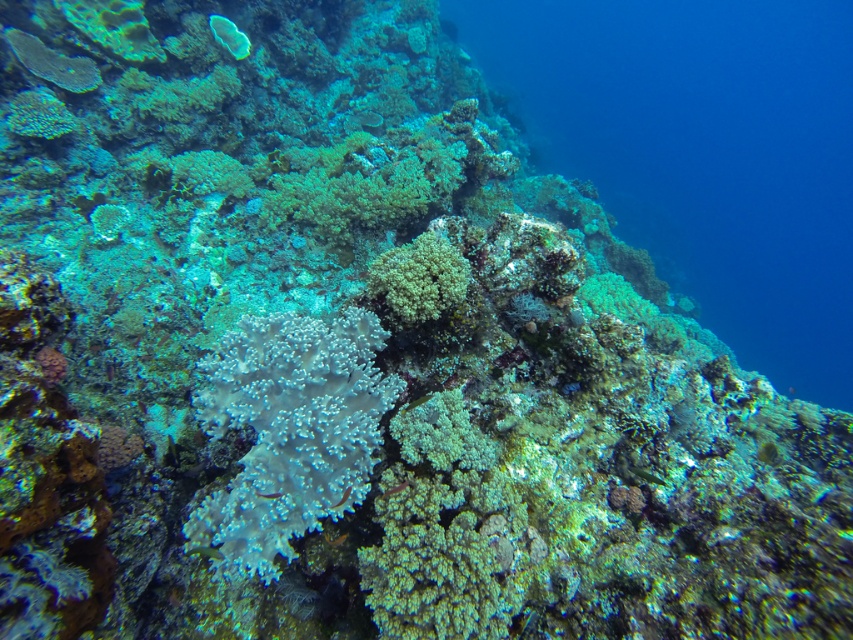
Which is above, translucent white coral at upper left or shiny green fish at center?

translucent white coral at upper left is higher up.

Does translucent white coral at upper left have a smaller size compared to shiny green fish at center?

No.

Locate an element on the screen. This screenshot has height=640, width=853. translucent white coral at upper left is located at coordinates (229, 35).

You are a GUI agent. You are given a task and a screenshot of the screen. Output one action in this format:
    pyautogui.click(x=<x>, y=<y>)
    Task: Click on the translucent white coral at upper left
    The image size is (853, 640).
    Given the screenshot: What is the action you would take?
    pyautogui.click(x=229, y=35)

Between green soft coral at center and translucent white coral at center, which one is positioned lower?

translucent white coral at center is below.

Does point (369, 273) come farther from viewer compared to point (346, 499)?

Yes, point (369, 273) is behind point (346, 499).

You are a GUI agent. You are given a task and a screenshot of the screen. Output one action in this format:
    pyautogui.click(x=<x>, y=<y>)
    Task: Click on the green soft coral at center
    The image size is (853, 640).
    Given the screenshot: What is the action you would take?
    pyautogui.click(x=419, y=276)

Where is `green soft coral at center`? This screenshot has height=640, width=853. green soft coral at center is located at coordinates (419, 276).

Can you confirm if translucent yellow fish at center is thinner than translucent white coral at center?

In fact, translucent yellow fish at center might be wider than translucent white coral at center.

Is translucent yellow fish at center below translucent white coral at center?

Correct, translucent yellow fish at center is located below translucent white coral at center.

Between point (335, 540) and point (346, 496), which one is positioned in front?

Point (346, 496) is more forward.

Where is `translucent yellow fish at center`? Image resolution: width=853 pixels, height=640 pixels. translucent yellow fish at center is located at coordinates (335, 540).